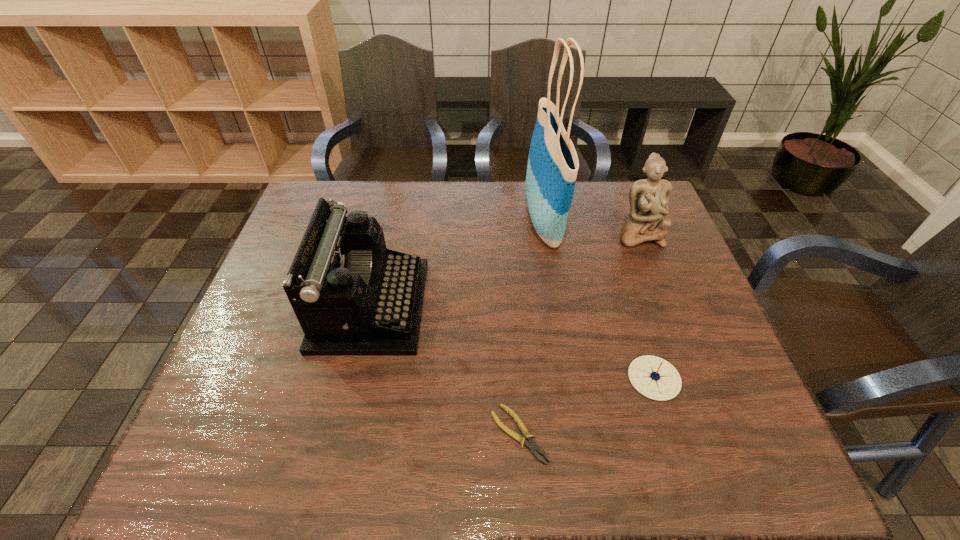
Identify the location of free region that satisfies the following two spatial constraints: 1. on the typing side of the typewriter; 2. on the back side of the compass. This screenshot has height=540, width=960. (354, 378).

Where is `free space that satisfies the following two spatial constraints: 1. on the typing side of the fourth object from right to left; 2. on the left side of the typewriter`? The height and width of the screenshot is (540, 960). free space that satisfies the following two spatial constraints: 1. on the typing side of the fourth object from right to left; 2. on the left side of the typewriter is located at coordinates (342, 434).

Image resolution: width=960 pixels, height=540 pixels. I want to click on blank area in the image that satisfies the following two spatial constraints: 1. on the typing side of the leftmost object; 2. on the right side of the pliers, so pos(342,434).

At what (x,y) coordinates should I click in order to perform the action: click on vacant region that satisfies the following two spatial constraints: 1. on the front-facing side of the figurine; 2. on the typing side of the leftmost object. Please return your answer as a coordinate pair (x, y). Looking at the image, I should click on point(666,306).